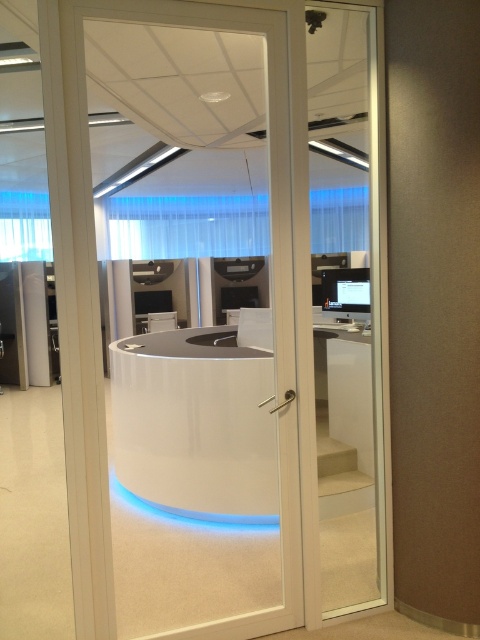
In the scene shown: You are a delivery person carrying a package that requires a 1.5 meter clearance to move through. You need to pass through the space between the transparent glass door at center and the matte black monitor at center. Can you safely navigate this path with your package?

The transparent glass door at center and matte black monitor at center are 1.38 meters apart. Since the required clearance is 1.5 meters, the distance is insufficient, so you cannot safely navigate this path with your package.

You are an office visitor approaching the entrance. You see the transparent glass door at center and the matte black monitor at center. Which object is closer to you as you approach?

The transparent glass door at center is closer to the viewer than the matte black monitor at center, so the transparent glass door at center is closer to you as you approach.